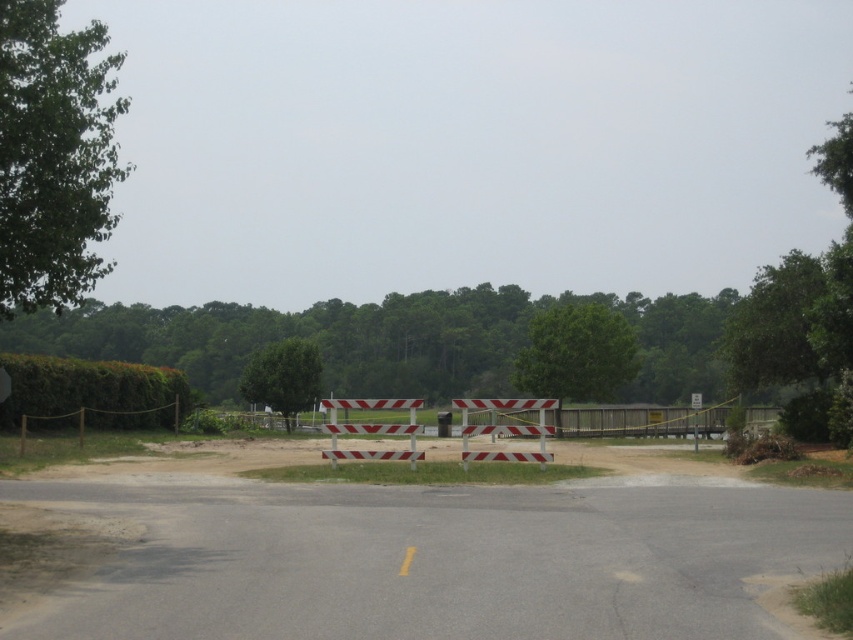
You are standing at the starting point of the road and want to reach the barricade at point (505, 428). Is the barricade located in the center of the road?

Yes, the reflective plastic barricade at center is located at point (505, 428), which is in the center of the road.

You are a delivery driver who needs to pass through the road blocked by the white striped plastic barricade at center and the white plastic sign at center. Based on their sizes, which object would be easier to move aside to create a path?

The white striped plastic barricade at center has a smaller size compared to the white plastic sign at center, so it would be easier to move aside to create a path.